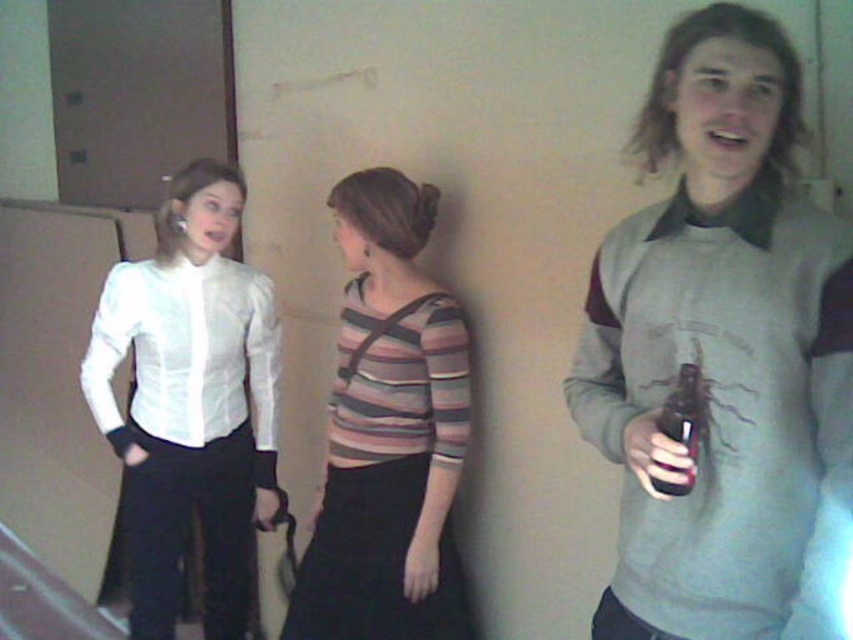
Which is behind, point (419, 362) or point (672, 410)?

The point (419, 362) is more distant.

Looking at this image, does striped fabric top at center appear on the left side of translucent plastic bottle at right?

Indeed, striped fabric top at center is positioned on the left side of translucent plastic bottle at right.

Is point (300, 579) more distant than point (671, 394)?

Yes, point (300, 579) is behind point (671, 394).

The image size is (853, 640). Identify the location of striped fabric top at center. (387, 433).

Is gray sweater at center wider than striped fabric top at center?

Incorrect, gray sweater at center's width does not surpass striped fabric top at center's.

Which is in front, point (618, 300) or point (430, 538)?

Positioned in front is point (618, 300).

This screenshot has width=853, height=640. Identify the location of gray sweater at center. (718, 342).

At what (x,y) coordinates should I click in order to perform the action: click on white satin blouse at left. Please return your answer as a coordinate pair (x, y). Image resolution: width=853 pixels, height=640 pixels. Looking at the image, I should click on (190, 403).

Is point (183, 422) behind point (354, 579)?

Yes, it is behind point (354, 579).

Is point (241, 330) more distant than point (360, 416)?

Yes, point (241, 330) is behind point (360, 416).

Find the location of a particular element. The image size is (853, 640). white satin blouse at left is located at coordinates (190, 403).